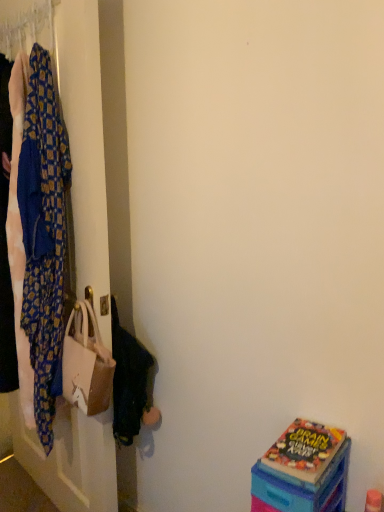
Question: Considering the positions of blue patterned fabric at left and matte plastic box at lower right in the image, is blue patterned fabric at left taller or shorter than matte plastic box at lower right?

Choices:
 (A) tall
 (B) short

Answer: (A)

Question: Is blue patterned fabric at left in front of or behind matte plastic box at lower right in the image?

Choices:
 (A) front
 (B) behind

Answer: (B)

Question: Which is nearer to the beige fabric handbag at left?

Choices:
 (A) matte plastic box at lower right
 (B) patterned fabric at left
 (C) blue patterned fabric at left

Answer: (C)

Question: Which object is the farthest from the beige fabric handbag at left?

Choices:
 (A) blue patterned fabric at left
 (B) matte plastic box at lower right
 (C) patterned fabric at left

Answer: (B)